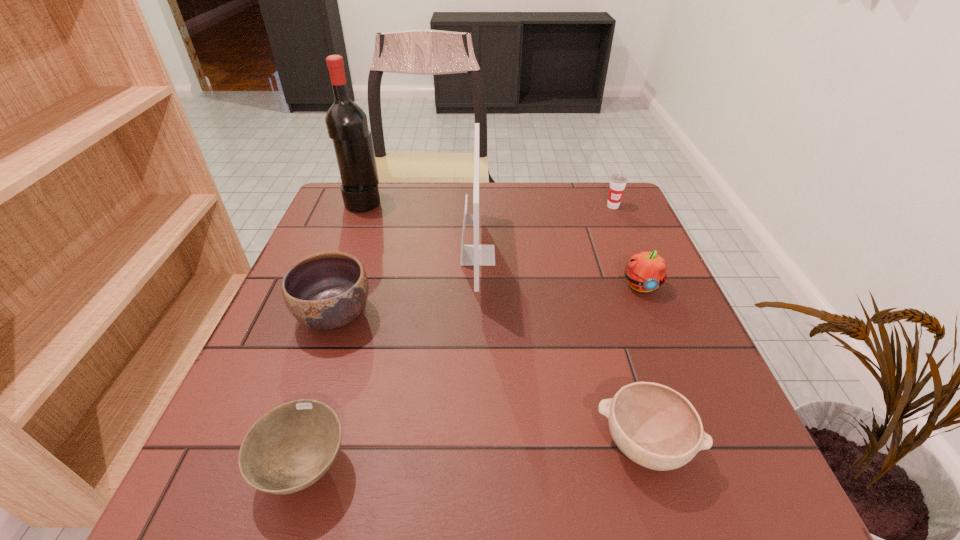
Identify which bowl is the nearest to the cup. Please provide its 2D coordinates. Your answer should be formatted as a tuple, i.e. [(x, y)], where the tuple contains the x and y coordinates of a point satisfying the conditions above.

[(655, 426)]

You are a GUI agent. You are given a task and a screenshot of the screen. Output one action in this format:
    pyautogui.click(x=<x>, y=<y>)
    Task: Click on the vacant position in the image that satisfies the following two spatial constraints: 1. on the front-facing side of the monitor; 2. on the back side of the apple
    
    Given the screenshot: What is the action you would take?
    pyautogui.click(x=477, y=286)

I want to click on vacant point that satisfies the following two spatial constraints: 1. on the front-facing side of the apple; 2. on the left side of the fourth object from right to left, so click(477, 286).

At what (x,y) coordinates should I click in order to perform the action: click on vacant point that satisfies the following two spatial constraints: 1. on the back side of the apple; 2. on the right side of the rightmost bowl. Please return your answer as a coordinate pair (x, y). Looking at the image, I should click on (596, 286).

At what (x,y) coordinates should I click in order to perform the action: click on free spot that satisfies the following two spatial constraints: 1. on the front side of the tallest bowl; 2. on the left side of the rightmost bowl. Please return your answer as a coordinate pair (x, y). Looking at the image, I should click on (290, 444).